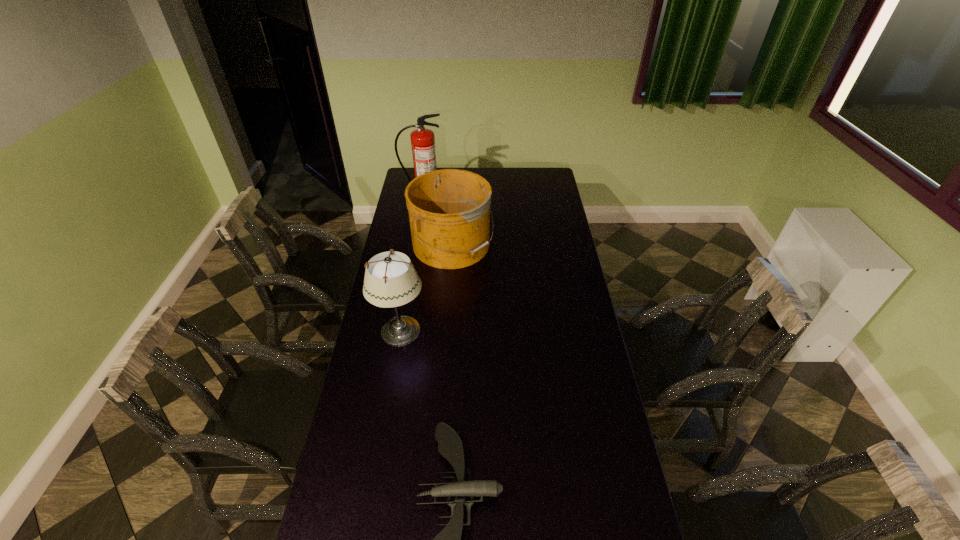
The image size is (960, 540). In order to click on fire extinguisher at the left edge in this screenshot , I will do `click(422, 140)`.

Where is `lampshade situated at the left edge`? lampshade situated at the left edge is located at coordinates (391, 280).

This screenshot has height=540, width=960. I want to click on bucket at the left edge, so click(x=449, y=210).

You are a GUI agent. You are given a task and a screenshot of the screen. Output one action in this format:
    pyautogui.click(x=<x>, y=<y>)
    Task: Click on the object that is positioned at the far left corner
    
    Given the screenshot: What is the action you would take?
    pyautogui.click(x=422, y=140)

Find the location of `free space at the left edge of the desktop`. free space at the left edge of the desktop is located at coordinates (409, 230).

The image size is (960, 540). In order to click on free spot at the right edge of the desktop in this screenshot , I will do coord(555,201).

Locate an element on the screen. empty space that is in between the third tallest object and the second tallest object is located at coordinates (426, 288).

Where is `empty space that is in between the tallest object and the third farthest object`? The height and width of the screenshot is (540, 960). empty space that is in between the tallest object and the third farthest object is located at coordinates (412, 262).

Where is `vacant area between the tallest object and the third farthest object`? The image size is (960, 540). vacant area between the tallest object and the third farthest object is located at coordinates (412, 262).

The width and height of the screenshot is (960, 540). In order to click on free spot between the farthest object and the lampshade in this screenshot , I will do `click(412, 262)`.